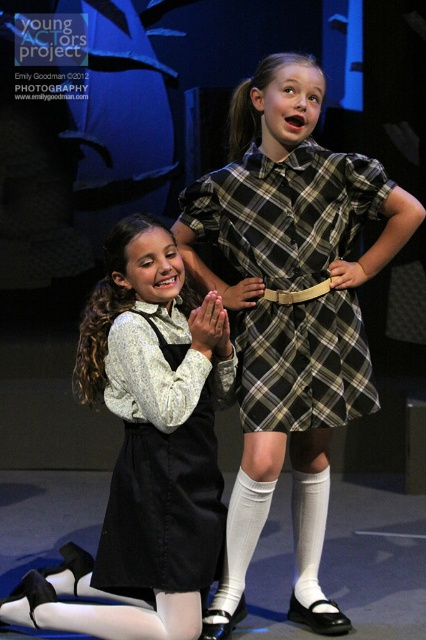
You are a stagehand who needs to place a microphone stand at a position that is exactly 2.5 meters away from the camera. The point where you need to place it is marked as point (x=331, y=188). Is the current distance of this point from the camera sufficient for placing the microphone stand?

The distance of point (x=331, y=188) from the camera is 2.47 meters, which is slightly less than the required 2.5 meters. Therefore, the microphone stand cannot be placed at this point as it does not meet the exact distance requirement.

Based on the scene description, where is the plaid fabric dress at center located in the image?

The plaid fabric dress at center is located at point (285, 211).

You are an audience member sitting in the front row of the theater. You notice two dresses on stage. The first is the matte black dress at center and the second is the black cotton dress at lower left. Which dress appears taller when viewed from your seat?

The matte black dress at center appears taller than the black cotton dress at lower left because it has a greater height as described.